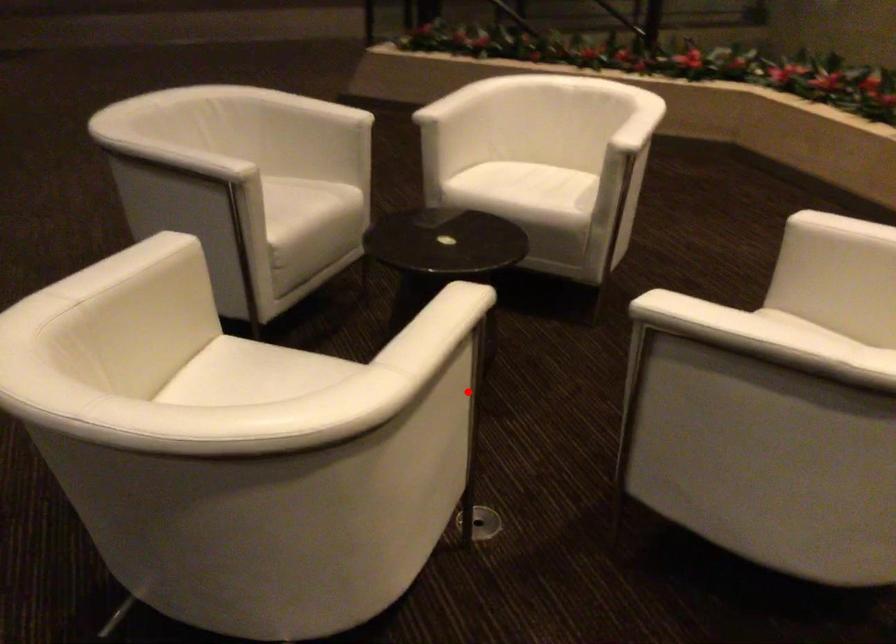
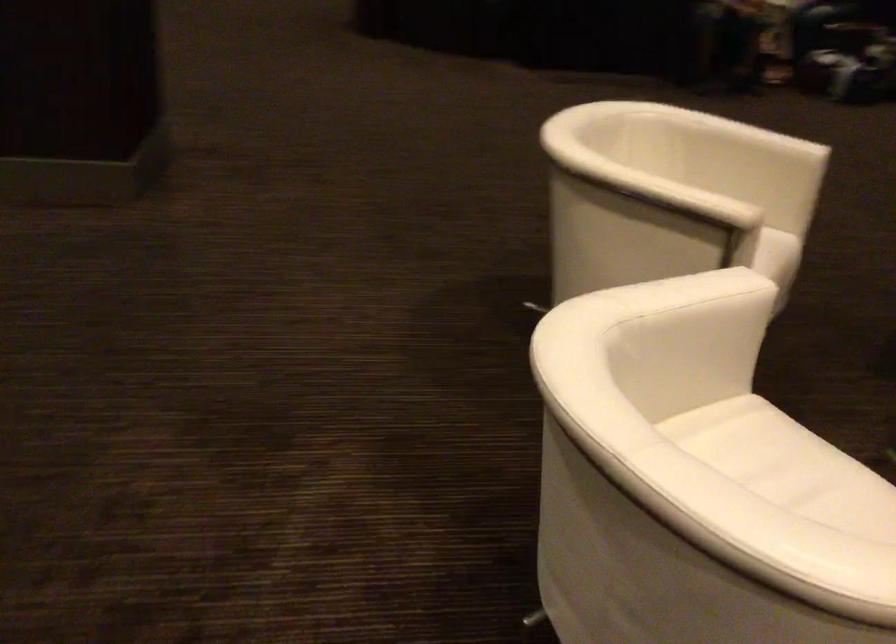
Question: A red point is marked in image1. In image2, is the corresponding 3D point closer to the camera or farther? Reply with the corresponding letter.

Choices:
 (A) The corresponding 3D point is closer.
 (B) The corresponding 3D point is farther.

Answer: (B)